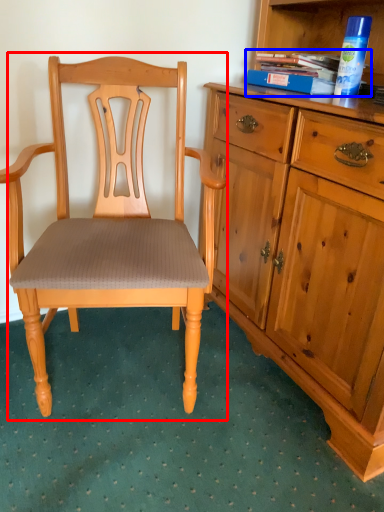
Question: Which point is further to the camera, chair (highlighted by a red box) or book (highlighted by a blue box)?

Choices:
 (A) chair
 (B) book

Answer: (B)